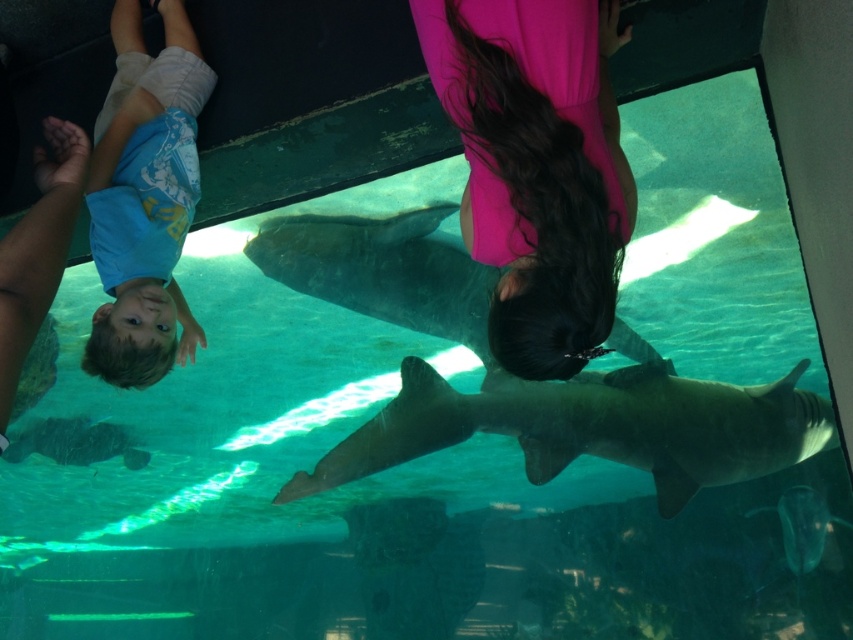
In the scene shown: You are a marine biologist studying the sharks in the aquarium. You notice the smooth gray shark at center and the blue cotton shirt at upper left. Which object is bigger in size?

The smooth gray shark at center is larger in size compared to the blue cotton shirt at upper left.

You are an aquatic biologist observing the aquarium. You need to place a 1 meter wide net between the pink fabric at center and the smooth gray shark at center. Can the net fit between them without overlapping either object?

The pink fabric at center has a lesser width compared to smooth gray shark at center. Since the net is 1 meter wide, and the space between them must be at least 1 meter, but the description only mentions their widths, not the distance between them. Therefore, we cannot determine if the net will fit based on the provided information.

You are a visitor at the aquarium and notice the pink fabric at center. Can you determine its exact coordinates within the image?

The pink fabric at center is located at point (537, 166).